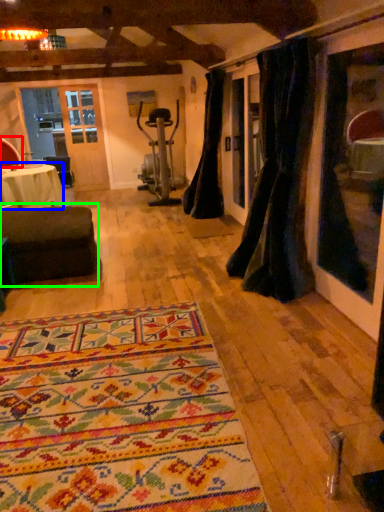
Question: Which object is positioned farthest from armchair (highlighted by a red box)? Select from table (highlighted by a blue box) and studio couch (highlighted by a green box).

Choices:
 (A) table
 (B) studio couch

Answer: (B)